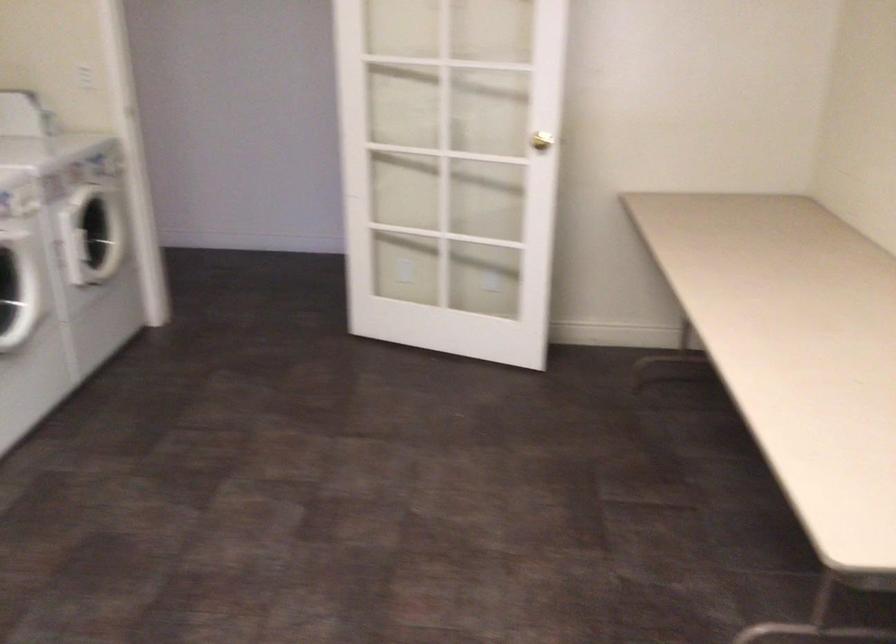
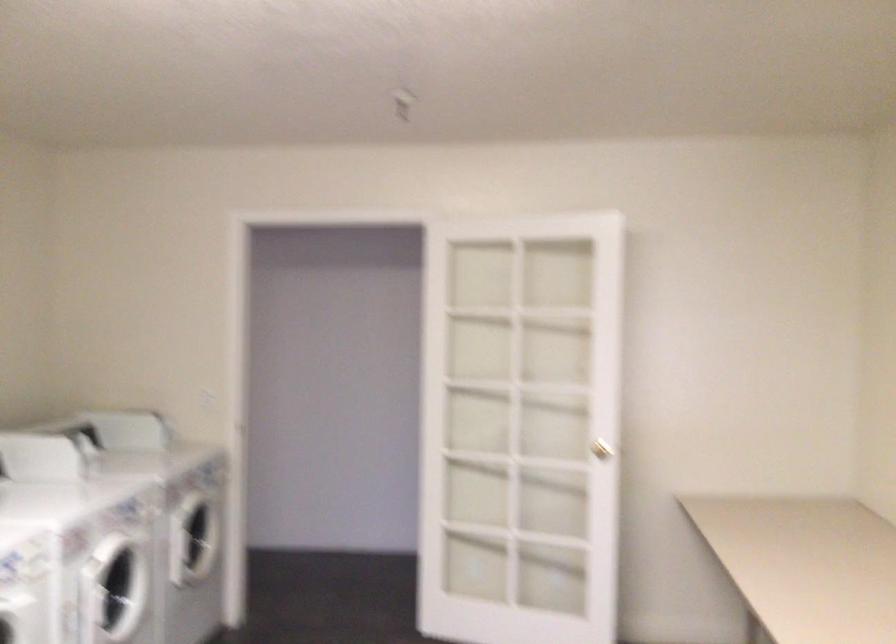
Question: The images are taken continuously from a first-person perspective. In which direction are you moving?

Choices:
 (A) Left
 (B) Right
 (C) Forward
 (D) Backward

Answer: (D)